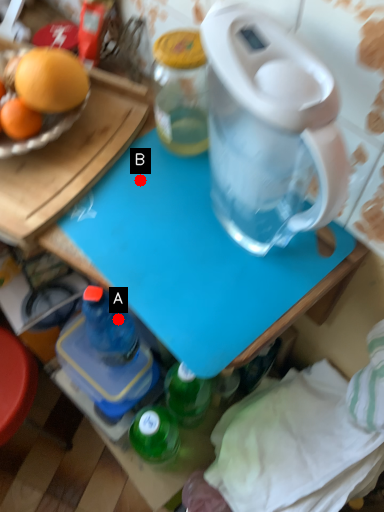
Question: Two points are circled on the image, labeled by A and B beside each circle. Which of the following is the closest to the observer?

Choices:
 (A) A is closer
 (B) B is closer

Answer: (B)